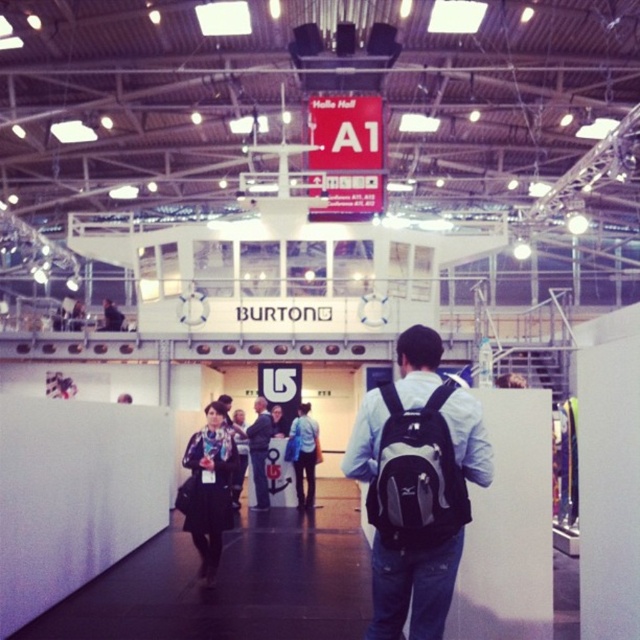
You are at the BURTON booth and notice two items at the center of the image. Which item is closer to you, the black backpack at center or the blue fabric jacket at center?

The black backpack at center is closer to you because it is in front of the blue fabric jacket at center.

You are standing in the exhibition hall and see the blue fabric jacket at center. Can you estimate its location in terms of coordinates?

The blue fabric jacket at center is located at coordinates point (x=305, y=454).